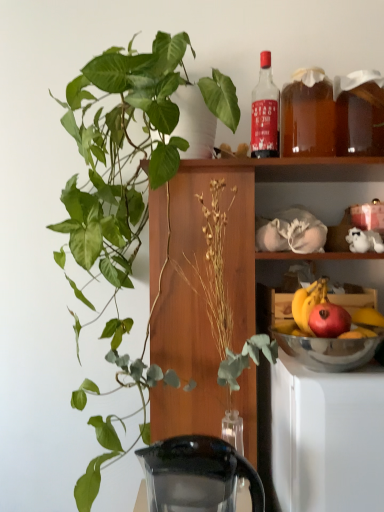
From the picture: How much space does translucent amber liquid at upper right, which is the first beverage from left to right, occupy horizontally?

The width of translucent amber liquid at upper right, which is the first beverage from left to right, is 12.23 centimeters.

Find the location of a particular element. shiny metallic bowl at lower right is located at coordinates (308, 303).

The image size is (384, 512). What do you see at coordinates (225, 275) in the screenshot?
I see `wooden cabinet at center` at bounding box center [225, 275].

Where is `red matte apple at right`? red matte apple at right is located at coordinates (329, 320).

At what (x,y) coordinates should I click in order to perform the action: click on transparent plastic coffeepot at lower left. Please return your answer as a coordinate pair (x, y). The width and height of the screenshot is (384, 512). Looking at the image, I should click on (196, 475).

Where is `silver metallic bowl at lower right`? This screenshot has height=512, width=384. silver metallic bowl at lower right is located at coordinates (329, 351).

Is matte glass bottle at upper right not inside red matte apple at right?

Absolutely, matte glass bottle at upper right is external to red matte apple at right.

Considering the relative sizes of matte glass bottle at upper right and red matte apple at right in the image provided, is matte glass bottle at upper right bigger than red matte apple at right?

Yes.

Based on the photo, is matte glass bottle at upper right aimed at red matte apple at right?

No.

Is green glossy plant at upper left facing towards transparent plastic coffeepot at lower left?

Yes, green glossy plant at upper left is oriented towards transparent plastic coffeepot at lower left.

Does point (151, 365) appear closer or farther from the camera than point (257, 501)?

Point (151, 365) is closer to the camera than point (257, 501).

From a real-world perspective, does green glossy plant at upper left sit lower than transparent plastic coffeepot at lower left?

No, from a real-world perspective, green glossy plant at upper left is not below transparent plastic coffeepot at lower left.

How different are the orientations of green glossy plant at upper left and transparent plastic coffeepot at lower left in degrees?

They differ by 0.813 degrees in their facing directions.

Considering the positions of point (328, 123) and point (313, 325), is point (328, 123) closer or farther from the camera than point (313, 325)?

Point (328, 123) is farther from the camera than point (313, 325).

From their relative heights in the image, would you say translucent amber liquid at upper right, which is the first beverage from left to right, is taller or shorter than red matte apple at right?

Clearly, translucent amber liquid at upper right, which is the first beverage from left to right, is taller compared to red matte apple at right.

From the picture: Is the depth of translucent amber liquid at upper right, acting as the second beverage starting from the right, greater than that of red matte apple at right?

Yes, the depth of translucent amber liquid at upper right, acting as the second beverage starting from the right, is greater than that of red matte apple at right.

Consider the image. Is shiny metallic bowl at lower right facing away from translucent amber liquid at upper right, acting as the second beverage starting from the right?

No, shiny metallic bowl at lower right is not facing the opposite direction of translucent amber liquid at upper right, acting as the second beverage starting from the right.

Measure the distance between shiny metallic bowl at lower right and translucent amber liquid at upper right, acting as the second beverage starting from the right.

A distance of 18.85 inches exists between shiny metallic bowl at lower right and translucent amber liquid at upper right, acting as the second beverage starting from the right.

From a real-world perspective, between shiny metallic bowl at lower right and translucent amber liquid at upper right, acting as the second beverage starting from the right, who is vertically lower?

shiny metallic bowl at lower right is physically lower.

Which is nearer, (300, 307) or (321, 126)?

The point (300, 307) is in front.

Consider the image. Is green glossy plant at upper left inside the boundaries of shiny metallic bowl at lower right, or outside?

The correct answer is: outside.

Which is behind, point (101, 187) or point (295, 307)?

The point (101, 187) is farther.

Which object is further away from the camera taking this photo, wooden cabinet at center or matte glass bottle at upper right?

matte glass bottle at upper right.

Can you tell me how much wooden cabinet at center and matte glass bottle at upper right differ in facing direction?

There is a 1.44-degree angle between the facing directions of wooden cabinet at center and matte glass bottle at upper right.

From a real-world perspective, which is physically below, wooden cabinet at center or matte glass bottle at upper right?

From a 3D spatial view, wooden cabinet at center is below.

In terms of height, does wooden cabinet at center look taller or shorter compared to matte glass bottle at upper right?

wooden cabinet at center is taller than matte glass bottle at upper right.

Is translucent amber liquid at shelf right, which appears as the 1th beverage when viewed from the right, outside of translucent amber liquid at upper right, which is the first beverage from left to right?

Result: Indeed, translucent amber liquid at shelf right, which appears as the 1th beverage when viewed from the right, is completely outside translucent amber liquid at upper right, which is the first beverage from left to right.

Which is in front, point (355, 81) or point (288, 103)?

The point (355, 81) is closer.

Is translucent amber liquid at shelf right, which appears as the 1th beverage when viewed from the right, facing towards translucent amber liquid at upper right, acting as the second beverage starting from the right?

No, translucent amber liquid at shelf right, which appears as the 1th beverage when viewed from the right, is not turned towards translucent amber liquid at upper right, acting as the second beverage starting from the right.

Between translucent amber liquid at shelf right, which appears as the 1th beverage when viewed from the right, and translucent amber liquid at upper right, which is the first beverage from left to right, which one appears on the left side from the viewer's perspective?

translucent amber liquid at upper right, which is the first beverage from left to right.

Image resolution: width=384 pixels, height=512 pixels. What are the coordinates of `apple on the right of matte glass bottle at upper right` in the screenshot? It's located at (329, 320).

This screenshot has width=384, height=512. I want to click on coffeepot directly beneath the green glossy plant at upper left (from a real-world perspective), so click(196, 475).

In the scene shown: Considering their positions, is transparent plastic coffeepot at lower left positioned closer to translucent amber liquid at shelf right, the 2th beverage positioned from the left, than green glossy plant at upper left?

green glossy plant at upper left is positioned closer to the anchor translucent amber liquid at shelf right, the 2th beverage positioned from the left.

Estimate the real-world distances between objects in this image. Which object is closer to green glossy plant at upper left, wooden cabinet at center or translucent amber liquid at shelf right, the 2th beverage positioned from the left?

wooden cabinet at center lies closer to green glossy plant at upper left than the other object.

Based on their spatial positions, is wooden cabinet at center or shiny metallic bowl at lower right closer to silver metallic bowl at lower right?

The object closer to silver metallic bowl at lower right is shiny metallic bowl at lower right.

Based on their spatial positions, is silver metallic bowl at lower right or wooden cabinet at center further from translucent amber liquid at upper right, acting as the second beverage starting from the right?

The object further to translucent amber liquid at upper right, acting as the second beverage starting from the right, is silver metallic bowl at lower right.

Estimate the real-world distances between objects in this image. Which object is further from wooden cabinet at center, shiny metallic bowl at lower right or translucent amber liquid at upper right, acting as the second beverage starting from the right?

Based on the image, shiny metallic bowl at lower right appears to be further to wooden cabinet at center.

Which object lies further to the anchor point transparent plastic coffeepot at lower left, green glossy plant at upper left or shiny metallic bowl at lower right?

green glossy plant at upper left is further to transparent plastic coffeepot at lower left.

Estimate the real-world distances between objects in this image. Which object is further from transparent plastic coffeepot at lower left, wooden cabinet at center or matte glass bottle at upper right?

matte glass bottle at upper right is further to transparent plastic coffeepot at lower left.

Looking at the image, which one is located closer to transparent plastic coffeepot at lower left, matte glass bottle at upper right or translucent amber liquid at shelf right, which appears as the 1th beverage when viewed from the right?

Based on the image, matte glass bottle at upper right appears to be nearer to transparent plastic coffeepot at lower left.

This screenshot has width=384, height=512. What are the coordinates of `beverage between translucent amber liquid at upper right, acting as the second beverage starting from the right, and red matte apple at right vertically` in the screenshot? It's located at (359, 113).

You are a GUI agent. You are given a task and a screenshot of the screen. Output one action in this format:
    pyautogui.click(x=<x>, y=<y>)
    Task: Click on the mixing bowl between translucent amber liquid at shelf right, the 2th beverage positioned from the left, and wooden cabinet at center vertically
    This screenshot has height=512, width=384.
    Given the screenshot: What is the action you would take?
    pyautogui.click(x=329, y=351)

The image size is (384, 512). What are the coordinates of `apple that lies between matte glass bottle at upper right and silver metallic bowl at lower right from top to bottom` in the screenshot? It's located at (329, 320).

Identify the location of cabinetry located between transparent plastic coffeepot at lower left and red matte apple at right in the left-right direction. (225, 275).